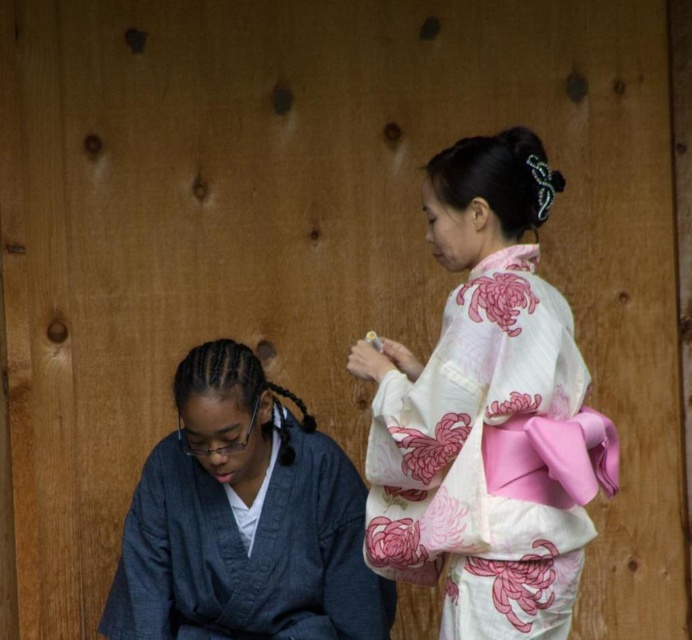
Question: Which object appears closest to the camera in this image?

Choices:
 (A) white floral kimono at right
 (B) denim robe at lower left

Answer: (A)

Question: From the image, what is the correct spatial relationship of white floral kimono at right in relation to denim robe at lower left?

Choices:
 (A) right
 (B) left

Answer: (A)

Question: Is white floral kimono at right to the right of denim robe at lower left from the viewer's perspective?

Choices:
 (A) no
 (B) yes

Answer: (B)

Question: Which point is farther from the camera taking this photo?

Choices:
 (A) (134, 509)
 (B) (547, 317)

Answer: (A)

Question: Does white floral kimono at right appear on the left side of denim robe at lower left?

Choices:
 (A) no
 (B) yes

Answer: (A)